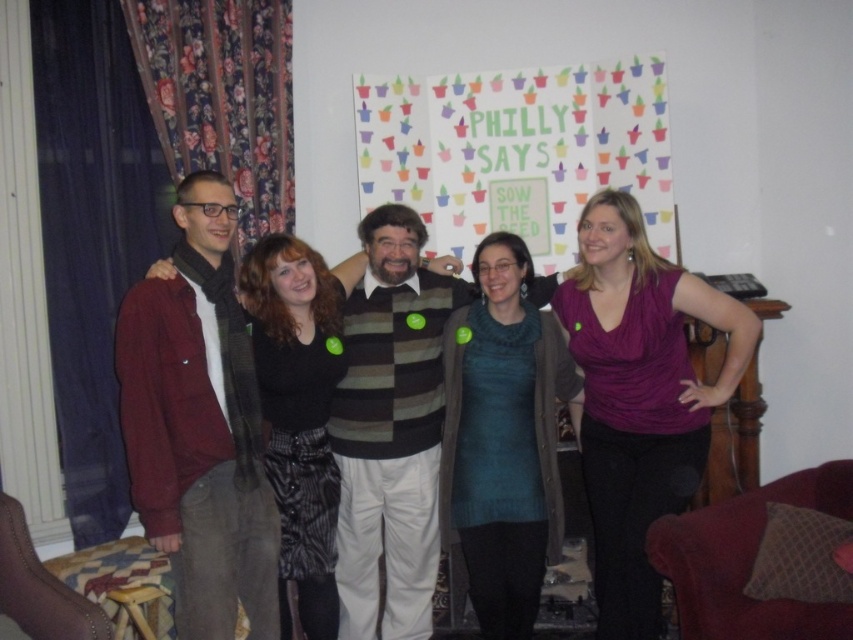
What is located at the coordinates point (518,150) in the image?

The multicolored paper poster at center is located at point (518,150).

You are a photographer trying to frame a shot that includes both the multicolored paper poster at center and the purple matte tank top at right. Which object is wider so that it can be better highlighted in the frame?

The multicolored paper poster at center is wider than the purple matte tank top at right, so it can be better highlighted in the frame.

You are standing in the living room where the group is posing for a photo. You need to hang a new poster exactly where the multicolored paper poster at center is currently located. What coordinates should you aim for?

The multicolored paper poster at center is positioned at coordinates point (518, 150), so you should aim for those coordinates to hang the new poster there.